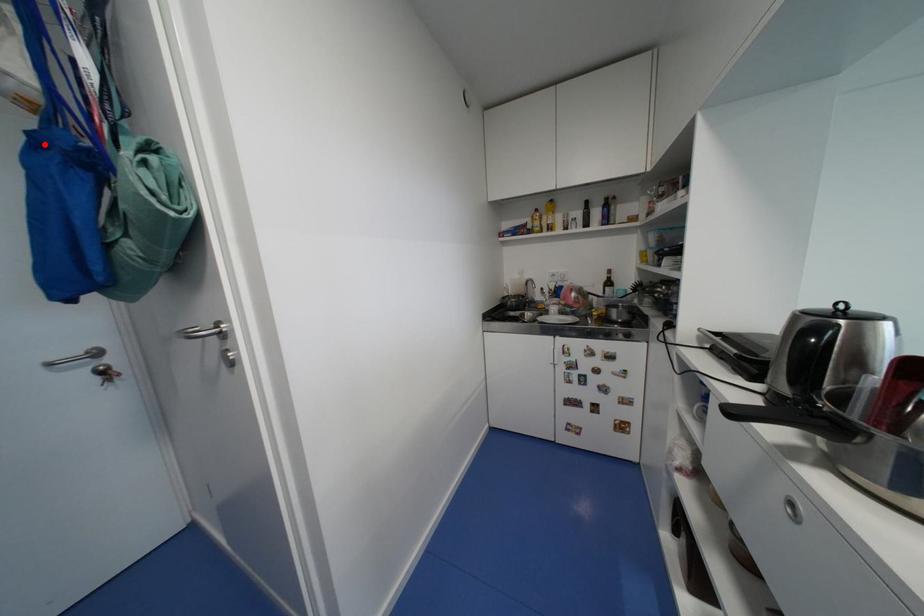
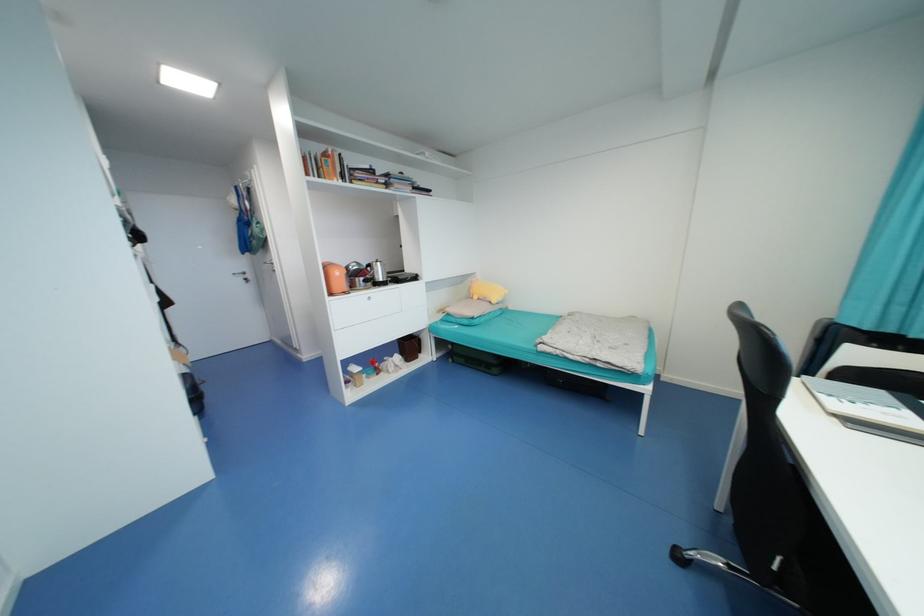
Question: I am providing you with two images of the same scene from different viewpoints. In image1, a red point is highlighted. Considering the same 3D point in image2, which of the following is correct?

Choices:
 (A) It is closer
 (B) It is farther

Answer: (A)